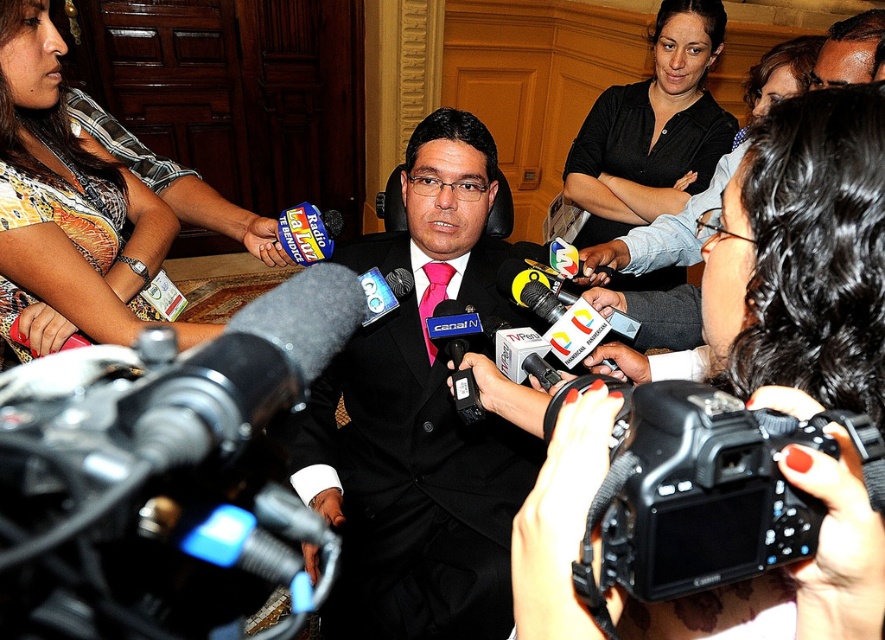
Which is behind, point (341, 608) or point (17, 83)?

The point (341, 608) is more distant.

Is black suit at center in front of printed fabric blouse at upper left?

No, black suit at center is behind printed fabric blouse at upper left.

Which is in front, point (362, 241) or point (108, 310)?

Point (108, 310) is more forward.

The height and width of the screenshot is (640, 885). Identify the location of black suit at center. (420, 419).

Can you confirm if black suit at center is shorter than black matte shirt at center?

In fact, black suit at center may be taller than black matte shirt at center.

The height and width of the screenshot is (640, 885). I want to click on black suit at center, so click(x=420, y=419).

At what (x,y) coordinates should I click in order to perform the action: click on black suit at center. Please return your answer as a coordinate pair (x, y). The height and width of the screenshot is (640, 885). Looking at the image, I should click on (420, 419).

Consider the image. Is printed fabric blouse at upper left smaller than black matte microphone at center?

Incorrect, printed fabric blouse at upper left is not smaller in size than black matte microphone at center.

Locate an element on the screen. The height and width of the screenshot is (640, 885). printed fabric blouse at upper left is located at coordinates (65, 198).